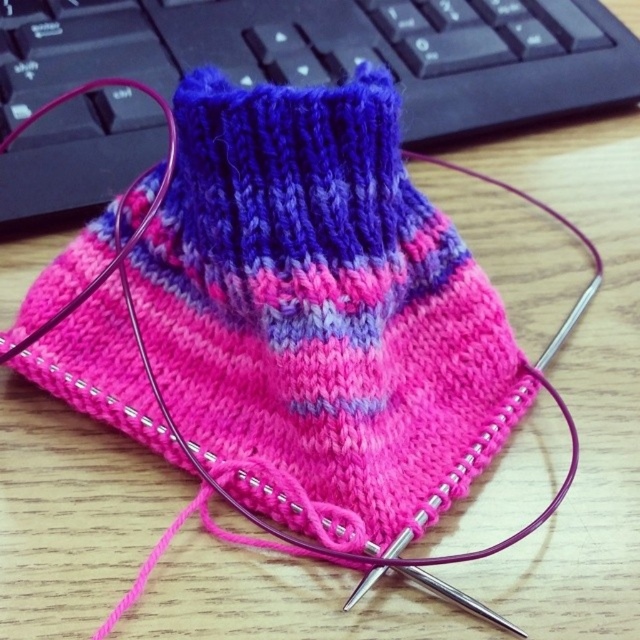
You are organizing a craft fair booth and need to place the pink yarn knit at center and the matte black keyboard at upper center on a display table. Given their sizes, which object should you place first to ensure stability?

The pink yarn knit at center is smaller than the matte black keyboard at upper center. To ensure stability, place the larger matte black keyboard at upper center first as a base, then position the smaller pink yarn knit at center on top or beside it.

You are organizing a craft fair booth and need to place the pink yarn knit at center and the matte black keyboard at upper center on a shelf. Which item should you place first if you want to arrange them from thinnest to thickest?

The pink yarn knit at center is thinner than the matte black keyboard at upper center, so you should place the pink yarn knit at center first when arranging from thinnest to thickest.

You are a knitter trying to locate two specific points on your project. The first point is at coordinate point (x=305, y=163) and the second is at point (x=150, y=52). Which point is nearer to your eyes as you look at the knitting project?

Point (x=305, y=163) is closer to the viewer than point (x=150, y=52).